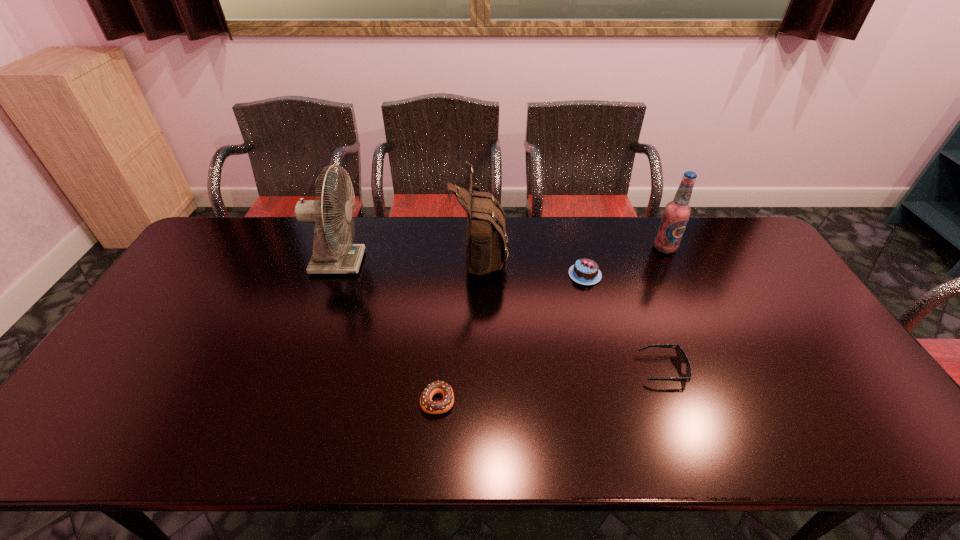
I want to click on vacant region that satisfies the following two spatial constraints: 1. on the front-facing side of the leftmost object; 2. on the right side of the doughnut, so click(289, 401).

Identify the location of vacant region that satisfies the following two spatial constraints: 1. on the front-facing side of the fan; 2. on the left side of the doughnut. (289, 401).

Identify the location of free space that satisfies the following two spatial constraints: 1. on the back side of the fourth tallest object; 2. on the front-facing side of the fan. (582, 262).